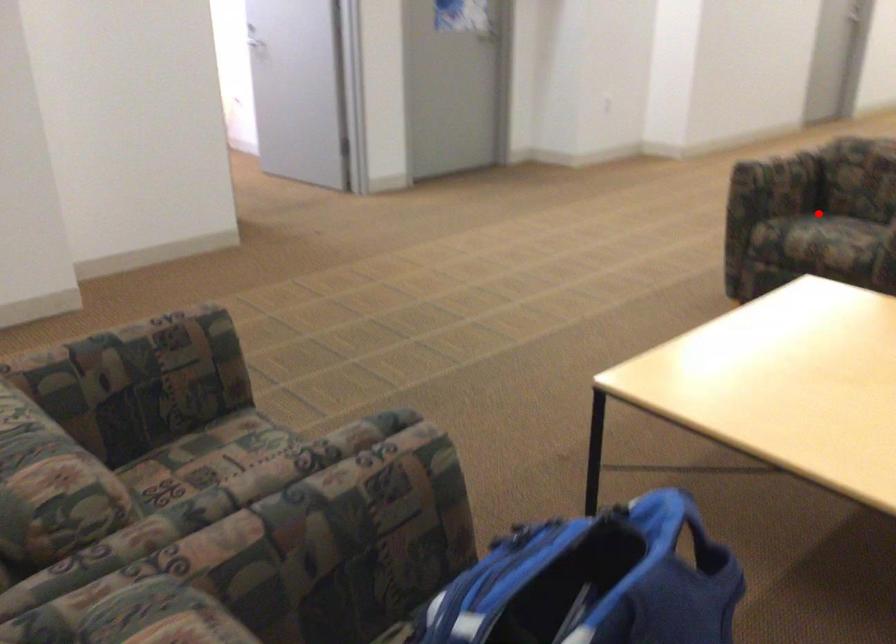
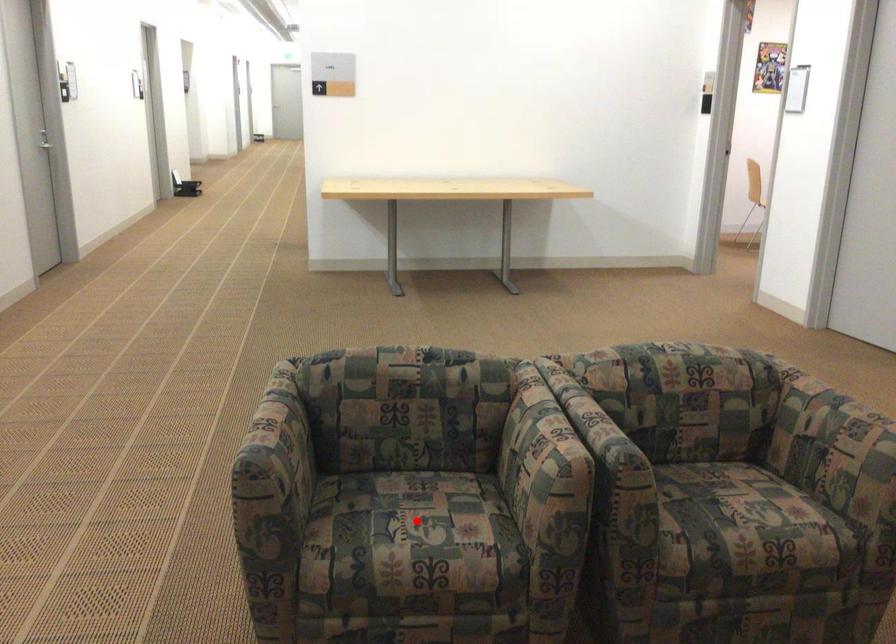
I am providing you with two images of the same scene from different viewpoints. A red point is marked on the first image and another point is marked on the second image. Do the highlighted points in image1 and image2 indicate the same real-world spot?

Yes